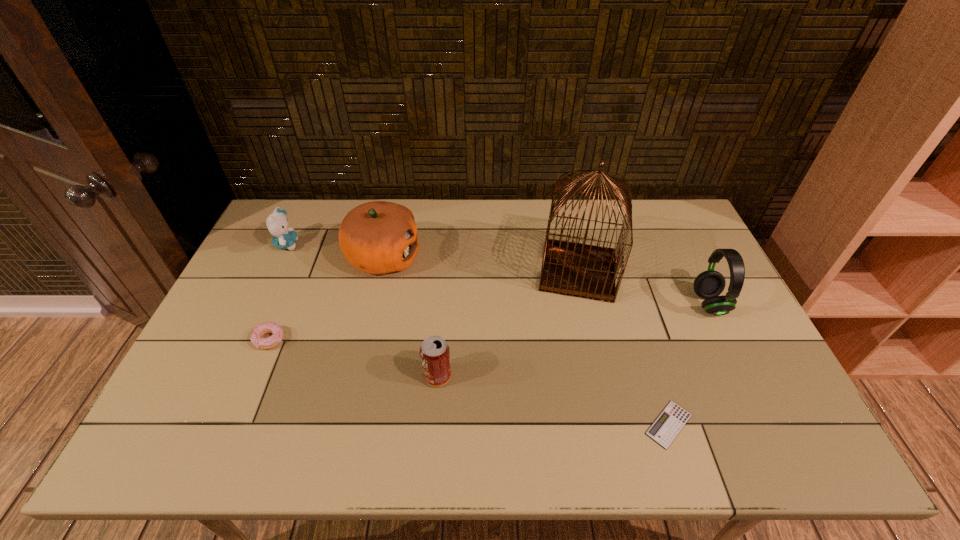
Find the location of a particular element. The width and height of the screenshot is (960, 540). free space at the far right corner of the desktop is located at coordinates (684, 231).

Identify the location of free space between the tallest object and the second nearest object. This screenshot has width=960, height=540. (508, 324).

This screenshot has height=540, width=960. In order to click on free space between the headset and the birdcage in this screenshot , I will do `click(643, 288)`.

The image size is (960, 540). I want to click on vacant space that's between the tallest object and the doughnut, so click(424, 306).

Find the location of a particular element. Image resolution: width=960 pixels, height=540 pixels. free spot between the rightmost object and the calculator is located at coordinates (688, 364).

Image resolution: width=960 pixels, height=540 pixels. In order to click on blank region between the doughnut and the shortest object in this screenshot , I will do `click(469, 382)`.

At what (x,y) coordinates should I click in order to perform the action: click on free space between the second nearest object and the fifth farthest object. Please return your answer as a coordinate pair (x, y). Looking at the image, I should click on pyautogui.click(x=353, y=358).

The width and height of the screenshot is (960, 540). In order to click on free space between the tallest object and the calculator in this screenshot , I will do `click(624, 348)`.

The image size is (960, 540). I want to click on vacant area that lies between the kitten and the rightmost object, so click(x=497, y=274).

Find the location of a particular element. This screenshot has height=540, width=960. blank region between the tallest object and the sixth farthest object is located at coordinates (508, 324).